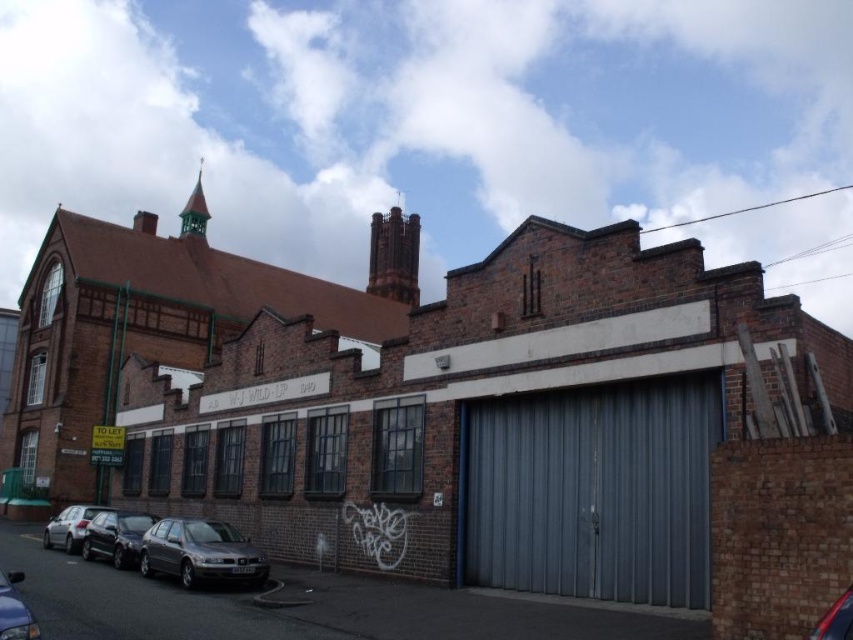
Question: Estimate the real-world distances between objects in this image. Which object is closer to the gray corrugated metal garage door at center?

Choices:
 (A) shiny black car at lower left
 (B) silver metallic car at lower left
 (C) metallic gray car at lower left
 (D) metallic gray sedan at lower left

Answer: (D)

Question: Does shiny black car at lower left have a larger size compared to metallic gray car at lower left?

Choices:
 (A) yes
 (B) no

Answer: (B)

Question: Can you confirm if gray corrugated metal garage door at center is wider than metallic gray car at lower left?

Choices:
 (A) no
 (B) yes

Answer: (A)

Question: Can you confirm if metallic gray sedan at lower left is positioned below shiny blue car at lower right?

Choices:
 (A) yes
 (B) no

Answer: (A)

Question: Which point appears closest to the camera in this image?

Choices:
 (A) (82, 518)
 (B) (175, 577)
 (C) (32, 614)

Answer: (C)

Question: Which object is farther from the camera taking this photo?

Choices:
 (A) shiny blue car at lower right
 (B) gray corrugated metal garage door at center
 (C) metallic gray car at lower left
 (D) shiny black car at lower left

Answer: (D)